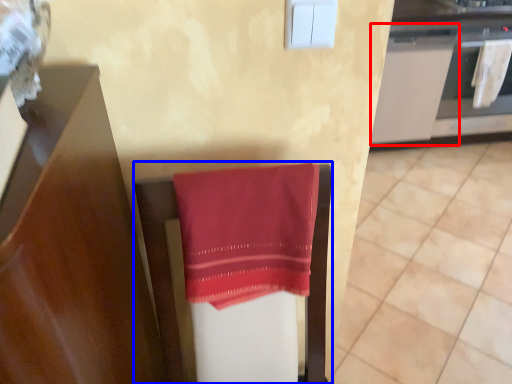
Question: Which object is closer to the camera taking this photo, cabinetry (highlighted by a red box) or furniture (highlighted by a blue box)?

Choices:
 (A) cabinetry
 (B) furniture

Answer: (B)